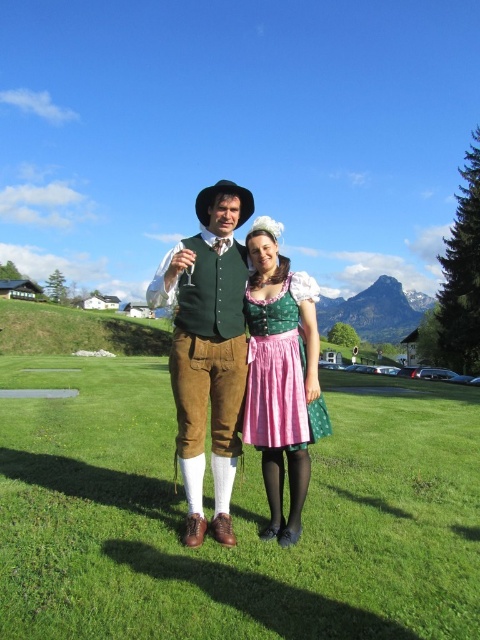
You are a photographer standing in front of the two people in the image. You want to take a photo where both subjects are in focus. Since you can only focus on one point at a time, which point should you choose to ensure both are in focus? Please choose between point A at coordinates point [350,378] and point B at coordinates point [276,333].

You should choose point A at coordinates point [350,378] because it is closer to the camera than point B at coordinates point [276,333]. By focusing on the closer point, the depth of field may extend to include the farther point, ensuring both subjects are in focus.

You are a photographer trying to capture the green velvety vest at center and the green satin dirndl at center in a single shot. Since both are green, how can you distinguish them in your photo?

The green velvety vest at center is positioned over the green satin dirndl at center, so you can distinguish them by their overlapping positions in the photo.